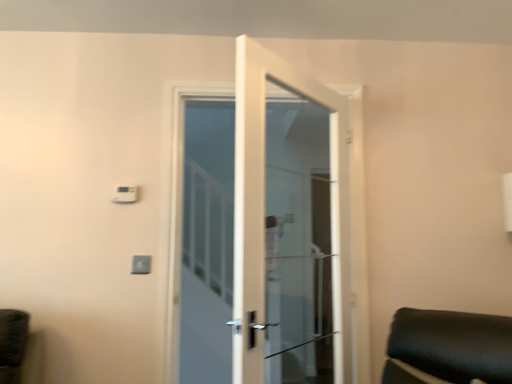
Question: From a real-world perspective, is white glass door at center positioned under white plastic light switch at upper center, which is the 1th light switch from bottom to top, based on gravity?

Choices:
 (A) yes
 (B) no

Answer: (B)

Question: Does white glass door at center lie behind white plastic light switch at upper center, which is the 1th light switch from bottom to top?

Choices:
 (A) no
 (B) yes

Answer: (A)

Question: Does white glass door at center appear on the left side of white plastic light switch at upper center, which is the 1th light switch from bottom to top?

Choices:
 (A) yes
 (B) no

Answer: (B)

Question: Does white glass door at center have a smaller size compared to white plastic light switch at upper center, the 2th light switch in the top-to-bottom sequence?

Choices:
 (A) yes
 (B) no

Answer: (B)

Question: Does white glass door at center have a larger size compared to white plastic light switch at upper center, the 2th light switch in the top-to-bottom sequence?

Choices:
 (A) no
 (B) yes

Answer: (B)

Question: Considering the positions of point (117, 192) and point (146, 258), is point (117, 192) closer or farther from the camera than point (146, 258)?

Choices:
 (A) closer
 (B) farther

Answer: (B)

Question: Looking at their shapes, would you say white plastic light switch at upper center, which ranks as the second light switch in right-to-left order, is wider or thinner than white plastic light switch at upper center, which appears as the second light switch when viewed from the left?

Choices:
 (A) thin
 (B) wide

Answer: (B)

Question: Based on their positions, is white plastic light switch at upper center, the second light switch in the bottom-to-top sequence, located to the left or right of white plastic light switch at upper center, which appears as the second light switch when viewed from the left?

Choices:
 (A) right
 (B) left

Answer: (B)

Question: From the image's perspective, is white plastic light switch at upper center, the second light switch in the bottom-to-top sequence, located above or below white plastic light switch at upper center, the 2th light switch in the top-to-bottom sequence?

Choices:
 (A) above
 (B) below

Answer: (A)

Question: Is white plastic light switch at upper center, which ranks as the second light switch in right-to-left order, in front of or behind white glass door at center in the image?

Choices:
 (A) behind
 (B) front

Answer: (A)

Question: Based on their positions, is white plastic light switch at upper center, which ranks as the second light switch in right-to-left order, located to the left or right of white glass door at center?

Choices:
 (A) right
 (B) left

Answer: (B)

Question: Is white plastic light switch at upper center, which appears as the 1th light switch when viewed from the top, inside the boundaries of white glass door at center, or outside?

Choices:
 (A) inside
 (B) outside

Answer: (B)

Question: Does point 122,200 appear closer or farther from the camera than point 241,274?

Choices:
 (A) closer
 (B) farther

Answer: (B)

Question: Is white plastic light switch at upper center, acting as the 1th light switch starting from the right, wider or thinner than white plastic light switch at upper center, the second light switch in the bottom-to-top sequence?

Choices:
 (A) thin
 (B) wide

Answer: (A)

Question: In the image, is white plastic light switch at upper center, acting as the 1th light switch starting from the right, positioned in front of or behind white plastic light switch at upper center, positioned as the first light switch in left-to-right order?

Choices:
 (A) behind
 (B) front

Answer: (B)